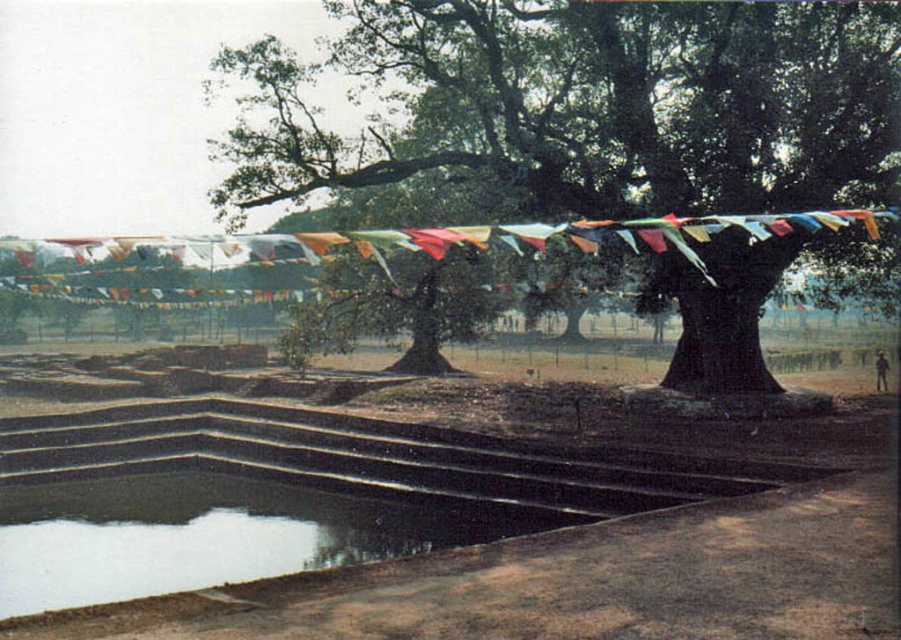
Question: Which point is farther to the camera?

Choices:
 (A) brown earthy dirt field at center
 (B) clear water at bottom left
 (C) green leafy tree at center

Answer: (C)

Question: Does brown earthy dirt field at center come in front of clear water at bottom left?

Choices:
 (A) yes
 (B) no

Answer: (A)

Question: In this image, where is brown earthy dirt field at center located relative to green leafy tree at center?

Choices:
 (A) below
 (B) above

Answer: (A)

Question: Is brown earthy dirt field at center below green leafy tree at center?

Choices:
 (A) no
 (B) yes

Answer: (B)

Question: Based on their relative distances, which object is farther from the clear water at bottom left?

Choices:
 (A) brown earthy dirt field at center
 (B) green leafy tree at center

Answer: (B)

Question: Among these objects, which one is nearest to the camera?

Choices:
 (A) green leafy tree at center
 (B) clear water at bottom left
 (C) brown earthy dirt field at center

Answer: (C)